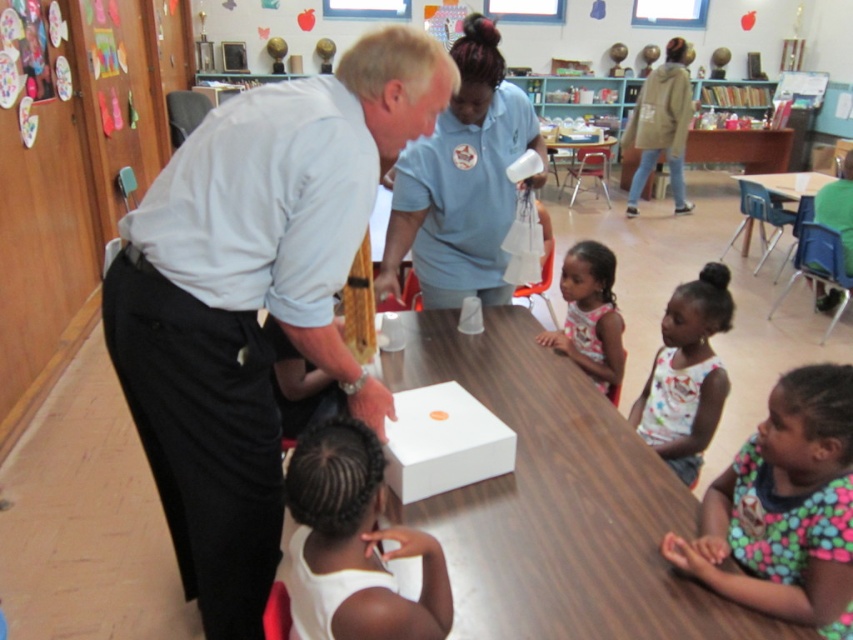
Question: Considering the relative positions of white cotton shirt at lower right and pink floral dress at center in the image provided, where is white cotton shirt at lower right located with respect to pink floral dress at center?

Choices:
 (A) above
 (B) below

Answer: (B)

Question: From the image, what is the correct spatial relationship of white matte box at center in relation to white plastic table at center?

Choices:
 (A) above
 (B) below

Answer: (B)

Question: Does pink floral dress at center have a greater width compared to wooden table at right?

Choices:
 (A) no
 (B) yes

Answer: (A)

Question: Which object is positioned closest to the white matte box at center?

Choices:
 (A) pink floral dress at center
 (B) white plastic table at center

Answer: (A)

Question: Among these objects, which one is farthest from the camera?

Choices:
 (A) white wood table at center
 (B) wooden table at right
 (C) white plastic table at center
 (D) white cotton shirt at lower right

Answer: (C)

Question: Which is farther from the white matte hair at lower center?

Choices:
 (A) white matte box at center
 (B) wooden table at right
 (C) matte blue shirt at center

Answer: (B)